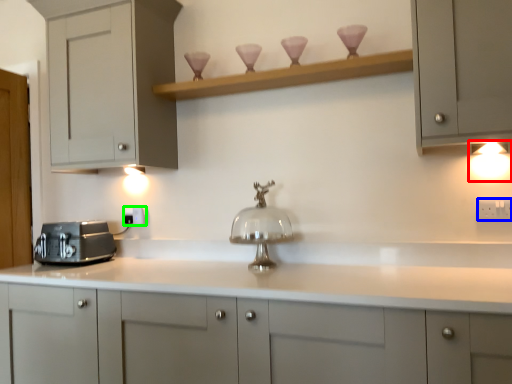
Question: Which is nearer to the light fixture (highlighted by a red box)? electric outlet (highlighted by a blue box) or electric outlet (highlighted by a green box).

Choices:
 (A) electric outlet
 (B) electric outlet

Answer: (A)